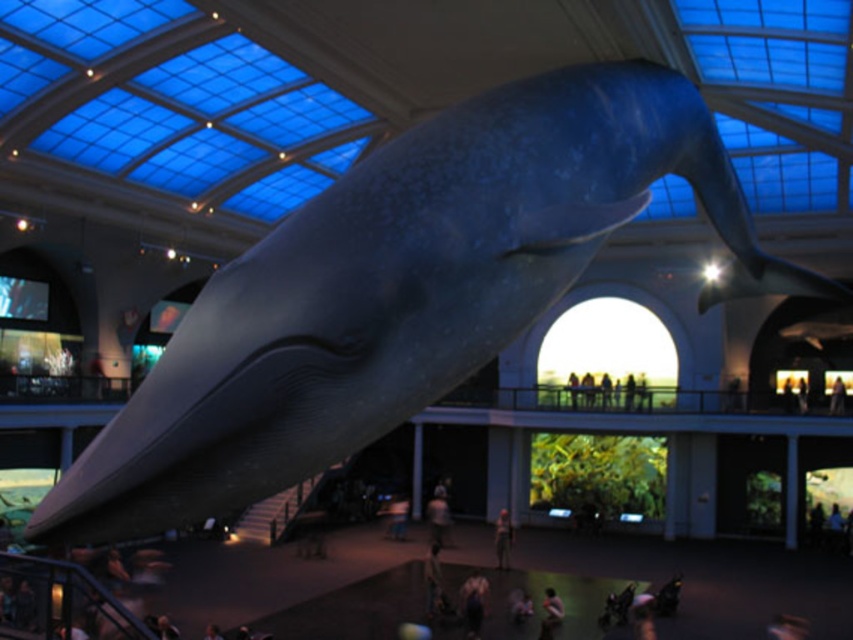
Question: Is dark gray fabric pants at center positioned in front of smooth skin person at lower center?

Choices:
 (A) no
 (B) yes

Answer: (A)

Question: Which point is closer to the camera?

Choices:
 (A) dark gray fabric pants at center
 (B) smooth skin person at lower center

Answer: (B)

Question: Can you confirm if dark gray fabric pants at center is positioned to the right of smooth skin person at lower center?

Choices:
 (A) no
 (B) yes

Answer: (A)

Question: Does dark gray fabric pants at center have a smaller size compared to smooth skin person at lower center?

Choices:
 (A) no
 (B) yes

Answer: (B)

Question: Which point is closer to the camera taking this photo?

Choices:
 (A) (498, 524)
 (B) (552, 596)

Answer: (B)